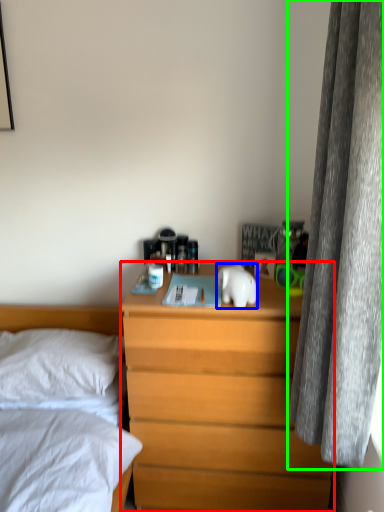
Question: Considering the real-world distances, which object is farthest from nightstand (highlighted by a red box)? animal (highlighted by a blue box) or curtain (highlighted by a green box)?

Choices:
 (A) animal
 (B) curtain

Answer: (B)